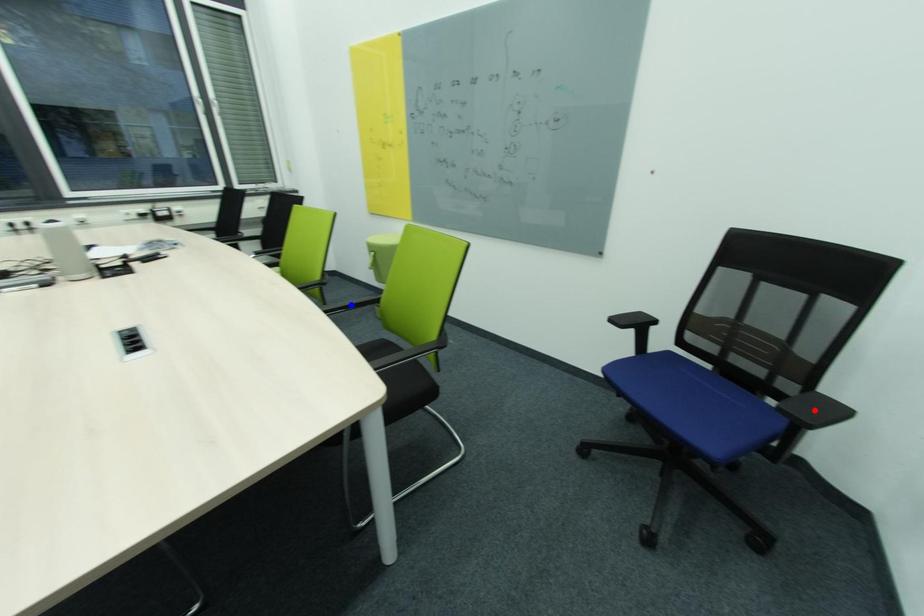
Question: In the image, two points are highlighted. Which point is nearer to the camera? Reply with the corresponding letter.

Choices:
 (A) blue point
 (B) red point

Answer: (B)